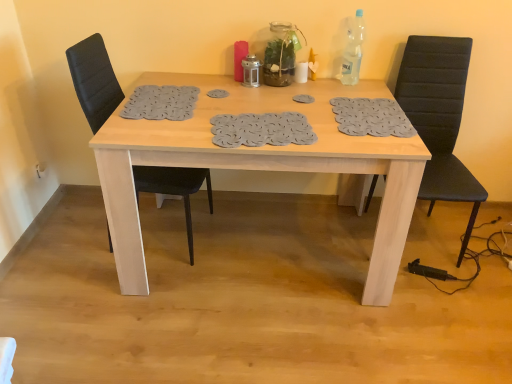
You are a GUI agent. You are given a task and a screenshot of the screen. Output one action in this format:
    pyautogui.click(x=<x>, y=<y>)
    Task: Click on the vacant area that is situated to the right of black leather chair at right, which is counted as the first chair, starting from the right
    The height and width of the screenshot is (384, 512).
    Given the screenshot: What is the action you would take?
    pyautogui.click(x=478, y=239)